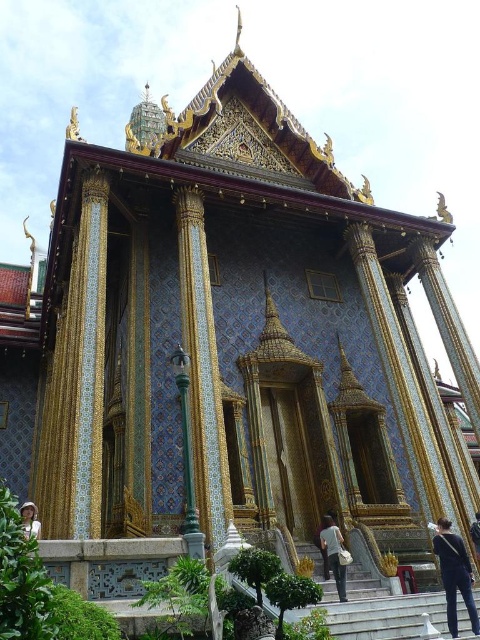
How far apart are green glazed tile pillar at center and white fabric hat at lower center?

They are 18.84 meters apart.

Is green glazed tile pillar at center above white fabric hat at lower center?

Yes, green glazed tile pillar at center is above white fabric hat at lower center.

Who is more forward, [204,481] or [26,524]?

Point [26,524] is in front.

Identify the location of green glazed tile pillar at center. This screenshot has height=640, width=480. (202, 369).

Who is more forward, (193, 228) or (471, 602)?

Point (471, 602) is more forward.

Is green glazed tile pillar at center to the right of dark blue jeans at lower right from the viewer's perspective?

Incorrect, green glazed tile pillar at center is not on the right side of dark blue jeans at lower right.

Find the location of a particular element. The height and width of the screenshot is (640, 480). green glazed tile pillar at center is located at coordinates (202, 369).

Identify the location of green glazed tile pillar at center. The image size is (480, 640). (202, 369).

Between green glazed tile pillar at center and light brown leather jacket at center, which one appears on the left side from the viewer's perspective?

green glazed tile pillar at center

Is point (189, 237) behind point (325, 547)?

Yes, it is.

Is point (197, 324) more distant than point (321, 529)?

That is False.

Identify the location of green glazed tile pillar at center. (202, 369).